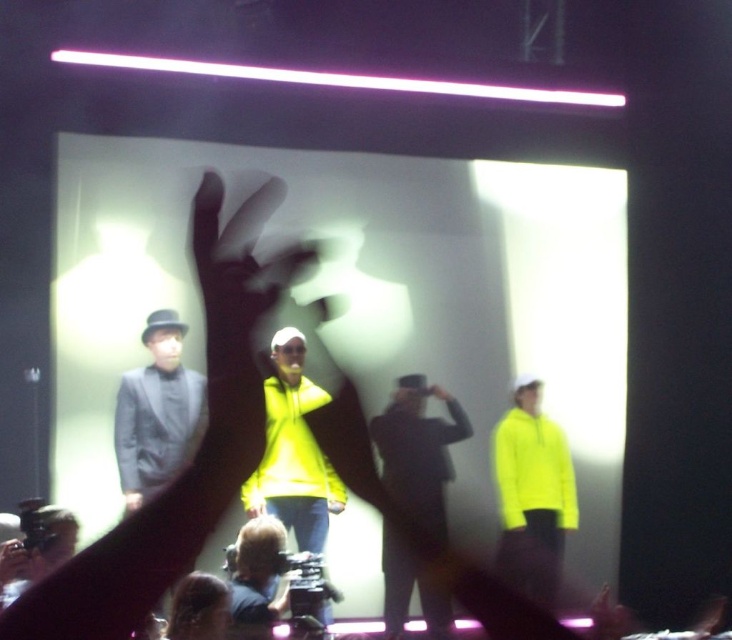
You are an event photographer positioned at the front row. You notice the dark gray suit at center and the neon yellow hoodie at right in your viewfinder. Which one appears larger in your photo?

The dark gray suit at center appears larger in the photo because it is closer to the viewer than the neon yellow hoodie at right.

You are a photographer at the event and need to capture a photo where both the dark gray suit at center and the neon yellow hoodie at right are clearly visible. Considering their heights, which one might you position closer to the camera to ensure both are in focus?

The dark gray suit at center is shorter than the neon yellow hoodie at right. To ensure both are in focus, position the dark gray suit at center closer to the camera since it is shorter and requires less depth of field adjustment compared to the taller neon yellow hoodie at right.

Based on the photo, you are an event coordinator checking the stage layout. You need to determine if the dark gray suit at center can fit into a storage box designed for the neon yellow hoodie at right. Can it fit based on their sizes?

The dark gray suit at center has a smaller size compared to the neon yellow hoodie at right, so it can fit into the storage box designed for the neon yellow hoodie at right.